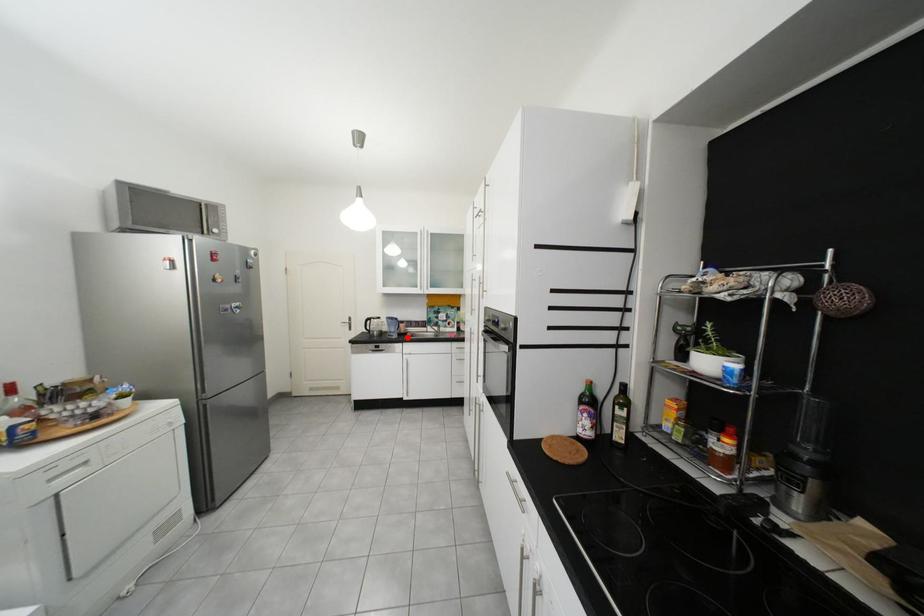
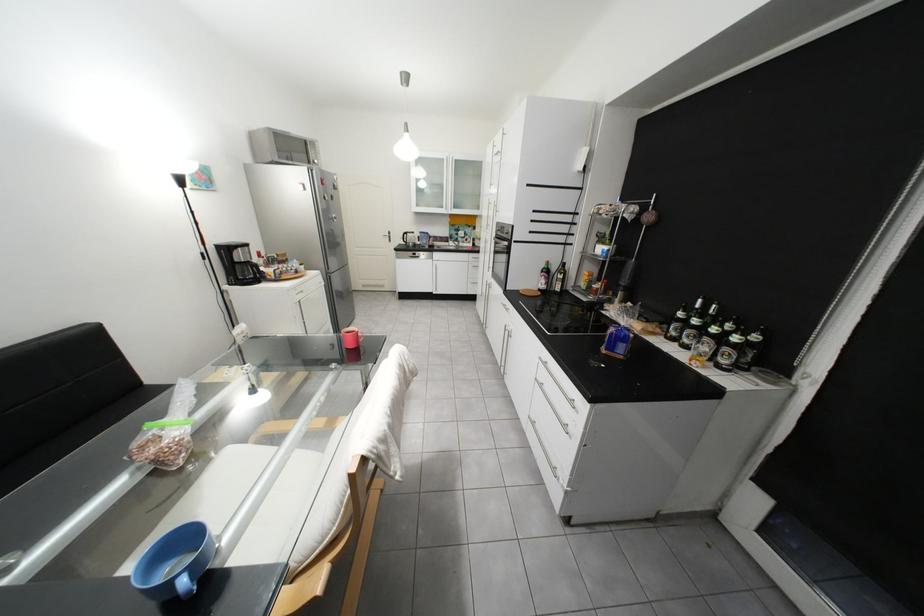
Where in the second image is the point corresponding to the highlighted location from the first image?

(439, 248)